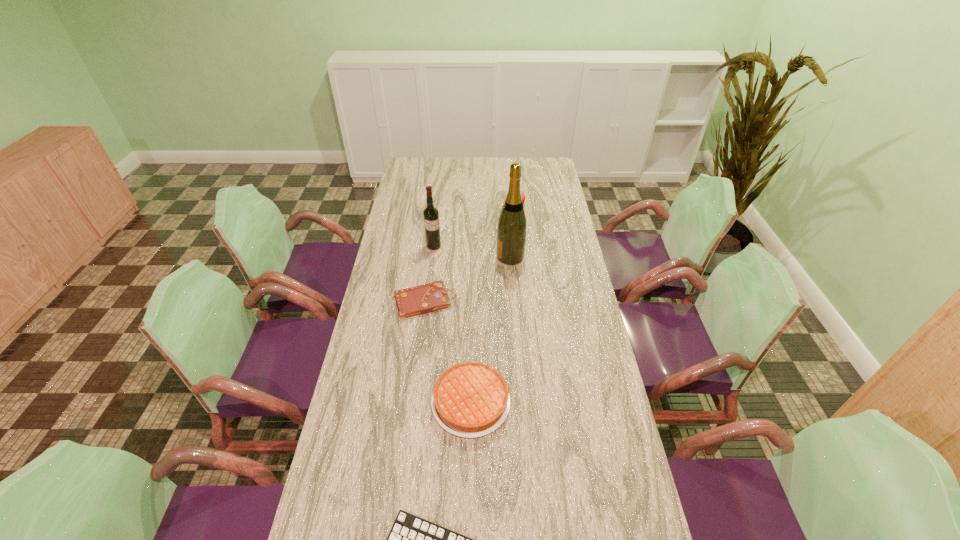
At what (x,y) coordinates should I click in order to perform the action: click on the tallest object. Please return your answer as a coordinate pair (x, y). Image resolution: width=960 pixels, height=540 pixels. Looking at the image, I should click on (512, 225).

Locate an element on the screen. The image size is (960, 540). the taller wine bottle is located at coordinates (512, 225).

This screenshot has width=960, height=540. Find the location of `the second tallest object`. the second tallest object is located at coordinates point(431,215).

Image resolution: width=960 pixels, height=540 pixels. Identify the location of the shorter wine bottle. (431, 215).

You are a GUI agent. You are given a task and a screenshot of the screen. Output one action in this format:
    pyautogui.click(x=<x>, y=<y>)
    Task: Click on the fourth shortest object
    This screenshot has width=960, height=540.
    Given the screenshot: What is the action you would take?
    pyautogui.click(x=522, y=194)

The height and width of the screenshot is (540, 960). What are the coordinates of `the farthest object` in the screenshot? It's located at (522, 194).

At what (x,y) coordinates should I click in order to perform the action: click on pie. Please return your answer as a coordinate pair (x, y). Looking at the image, I should click on (470, 399).

What are the coordinates of `the second nearest object` in the screenshot? It's located at (470, 399).

Locate an element on the screen. Image resolution: width=960 pixels, height=540 pixels. the fourth farthest object is located at coordinates (426, 298).

You are a GUI agent. You are given a task and a screenshot of the screen. Output one action in this format:
    pyautogui.click(x=<x>, y=<y>)
    Task: Click on the vacant point located 0.130m on the front-facing side of the right wine bottle
    This screenshot has width=960, height=540.
    Given the screenshot: What is the action you would take?
    pyautogui.click(x=465, y=256)